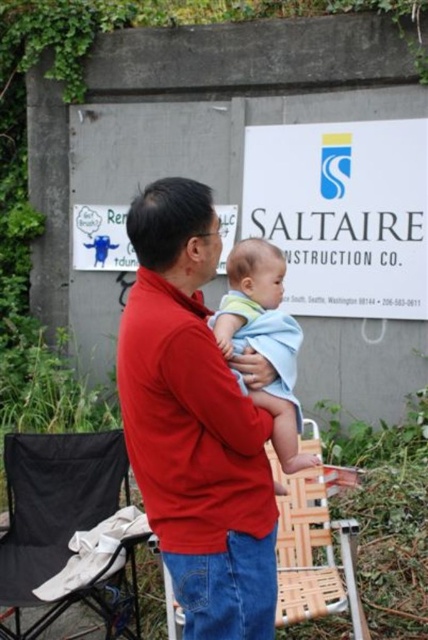
You are a photographer trying to capture a closeup of the baby in the image. You notice two points marked at coordinates point (x=139, y=337) and point (x=109, y=593). Which point should you focus on to ensure the baby is in sharp focus?

You should focus on point (x=139, y=337) because it is closer to the camera than point (x=109, y=593), so it will be in sharper focus.

You are a photographer setting up a shoot in this scene. You need to place a tripod exactly at the position of the black fabric folding chair at lower left. What are the coordinates where you should place the tripod?

The coordinates for the black fabric folding chair at lower left are point (64, 524), so you should place the tripod there.

Looking at this image, you are a photographer setting up for a portrait. You notice a black fabric folding chair at lower left and a blue cotton baby at center in the scene. Which object takes up more space in the photo?

The black fabric folding chair at lower left is larger in size than the blue cotton baby at center, so it takes up more space in the photo.